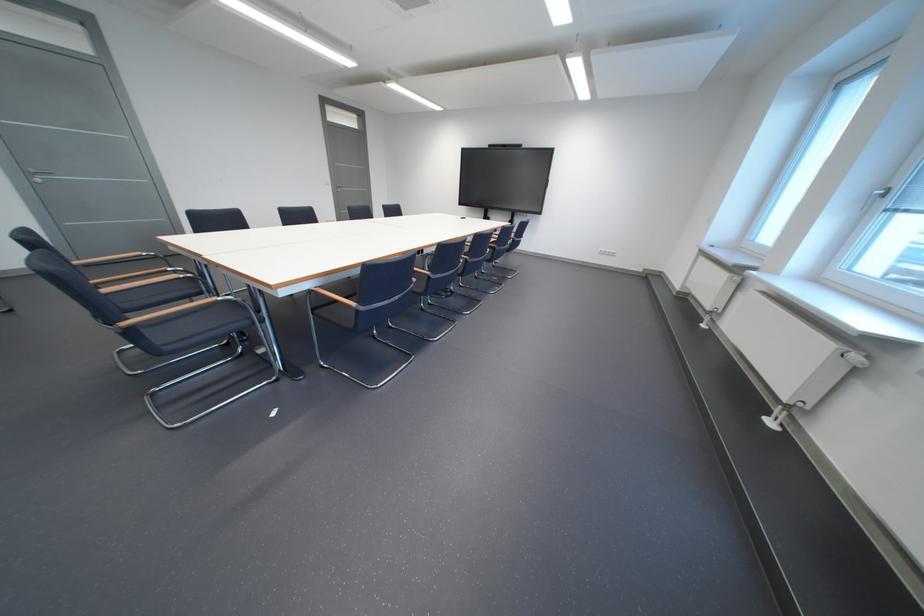
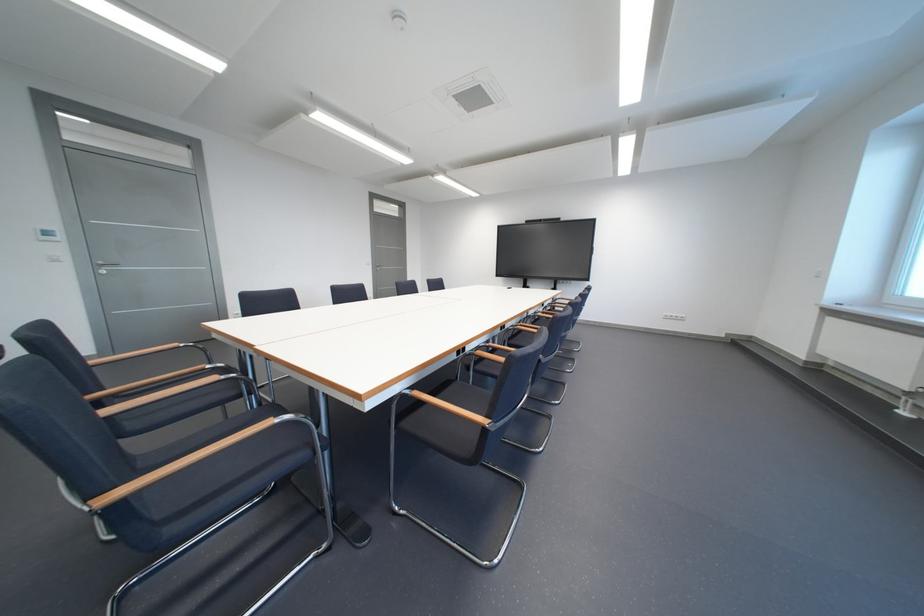
Find the pixel in the second image that matches pixel 233 301 in the first image.

(289, 422)